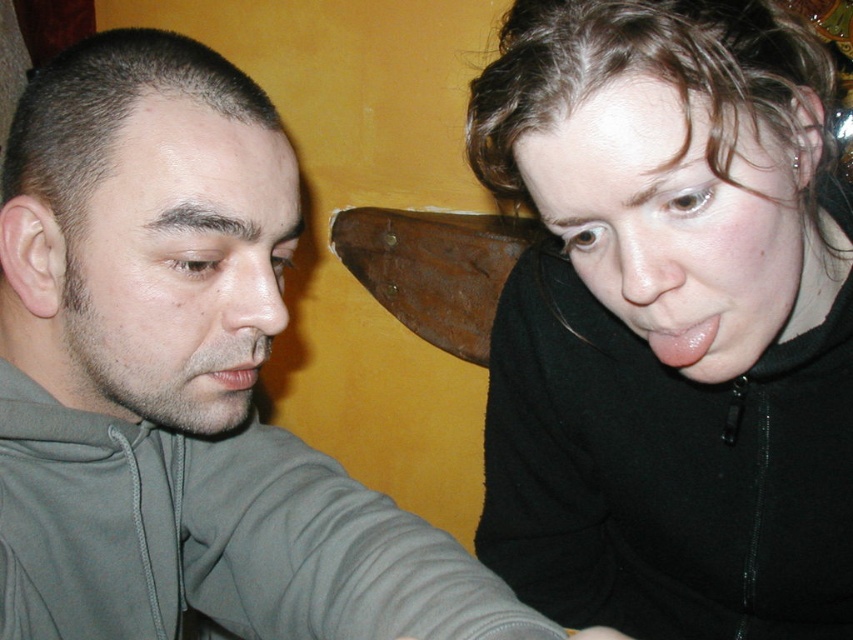
Question: Which of these objects is positioned farthest from the gray fleece sweatshirt at left?

Choices:
 (A) matte gray mouth at lower left
 (B) gray matte hoodie at left
 (C) black fleece jacket at upper right

Answer: (C)

Question: Observing the image, what is the correct spatial positioning of gray matte hoodie at left in reference to gray fleece sweatshirt at left?

Choices:
 (A) below
 (B) above

Answer: (B)

Question: Among these objects, which one is nearest to the camera?

Choices:
 (A) black fleece jacket at upper right
 (B) glossy pink tongue at upper right
 (C) gray fleece sweatshirt at left
 (D) matte gray mouth at lower left

Answer: (C)

Question: Does gray fleece sweatshirt at left appear on the right side of matte gray mouth at lower left?

Choices:
 (A) no
 (B) yes

Answer: (A)

Question: Can you confirm if glossy pink tongue at upper right is smaller than matte gray mouth at lower left?

Choices:
 (A) yes
 (B) no

Answer: (A)

Question: Which point is closer to the camera taking this photo?

Choices:
 (A) coord(67,529)
 (B) coord(300,596)

Answer: (B)